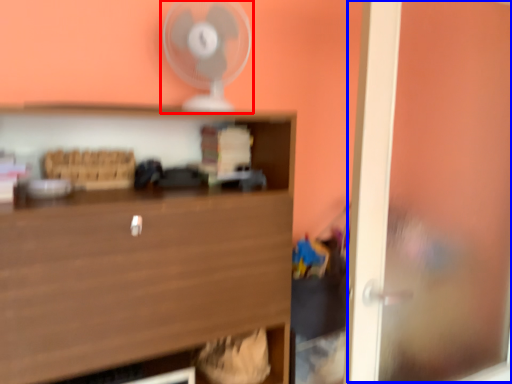
Question: Which point is closer to the camera, fan (highlighted by a red box) or window (highlighted by a blue box)?

Choices:
 (A) fan
 (B) window

Answer: (B)